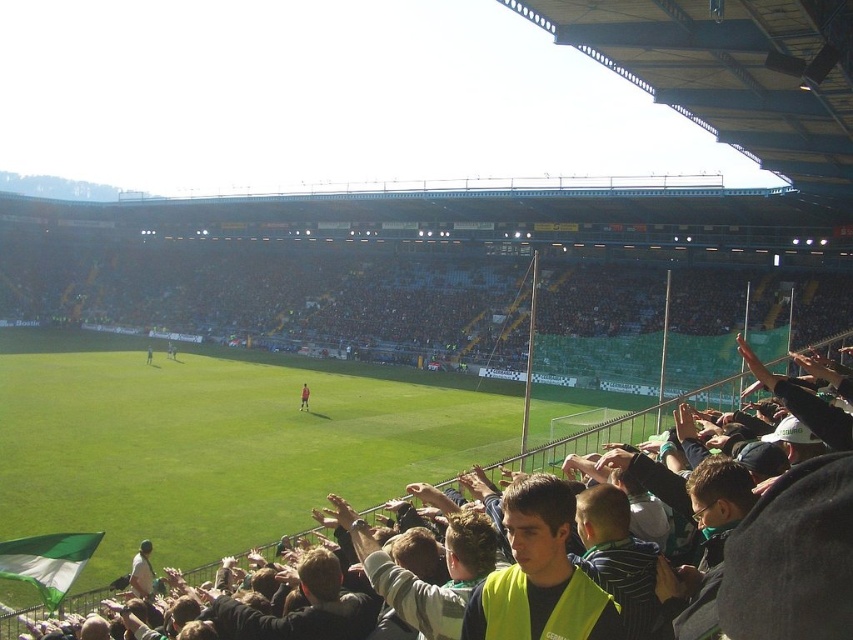
Consider the image. You are a drone operator flying a drone over the football stadium. You notice the yellow safety vest at center and the dark green jersey at center. Which object is higher from the ground?

The yellow safety vest at center is located above the dark green jersey at center, so it is higher from the ground.